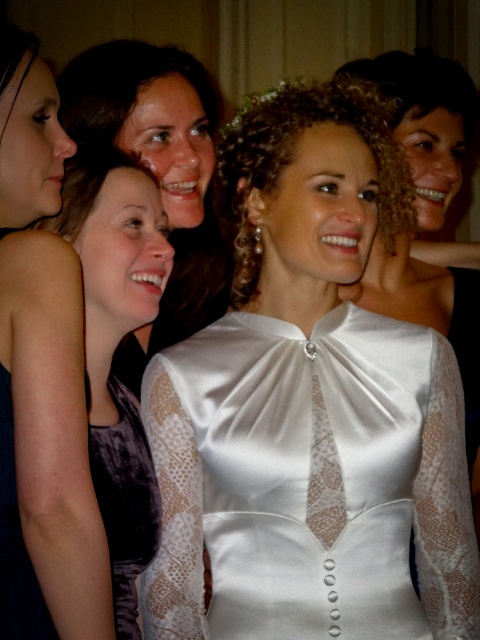
You are a photographer at a formal event. You need to arrange two dresses, the matte black dress at left and the matte purple dress at center, for a photo shoot. Based on their sizes, which dress should be placed closer to the camera to ensure they appear balanced in the frame?

The matte black dress at left is smaller than the matte purple dress at center. To balance their sizes in the frame, the smaller matte black dress at left should be placed closer to the camera so it appears larger, matching the visual size of the matte purple dress at center.

You are a photographer at the event and want to capture a closeup of both the satin white dress at center and the velvet purple dress at lower left. Given the camera lens you have, you can only focus on one subject at a time. Which dress should you focus on to ensure the other is still in the background? Explain your reasoning based on their positions.

The satin white dress at center is wider than the velvet purple dress at lower left. Therefore, focusing on the satin white dress at center would keep the velvet purple dress at lower left in the background since it is smaller in size and positioned further away.

You are standing in front of the group of women and want to determine which of the two points, point (1, 330) or point (115, 481), is closer to you. Based on the image, which point is nearer?

Point (1, 330) is closer to the viewer than point (115, 481).